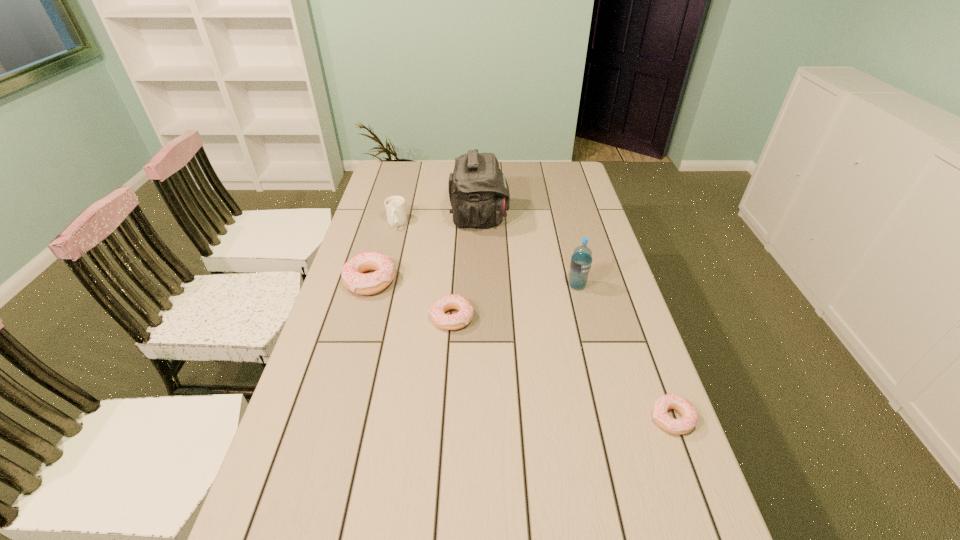
I want to click on vacant area at the far edge, so click(528, 166).

In the image, there is a desktop. Where is `vacant space at the left edge`? vacant space at the left edge is located at coordinates (407, 189).

Image resolution: width=960 pixels, height=540 pixels. I want to click on free space at the right edge, so click(x=641, y=335).

The image size is (960, 540). Find the location of `vacant space at the far left corner of the desktop`. vacant space at the far left corner of the desktop is located at coordinates tap(408, 187).

Where is `empty space that is in between the second object from right to left and the fourth shortest object`? Image resolution: width=960 pixels, height=540 pixels. empty space that is in between the second object from right to left and the fourth shortest object is located at coordinates (487, 254).

The image size is (960, 540). In order to click on free space between the tallest object and the third shortest object in this screenshot , I will do `click(425, 249)`.

This screenshot has height=540, width=960. Find the location of `blank region between the fourth tallest object and the shoulder bag`. blank region between the fourth tallest object and the shoulder bag is located at coordinates (425, 249).

Find the location of a particular element. vacant space that's between the shoulder bag and the farthest doughnut is located at coordinates (425, 249).

This screenshot has height=540, width=960. I want to click on vacant space that is in between the cappuccino and the second shortest doughnut, so click(x=424, y=271).

At what (x,y) coordinates should I click in order to perform the action: click on vacant space in between the leftmost doughnut and the second nearest object. Please return your answer as a coordinate pair (x, y). The height and width of the screenshot is (540, 960). Looking at the image, I should click on (411, 299).